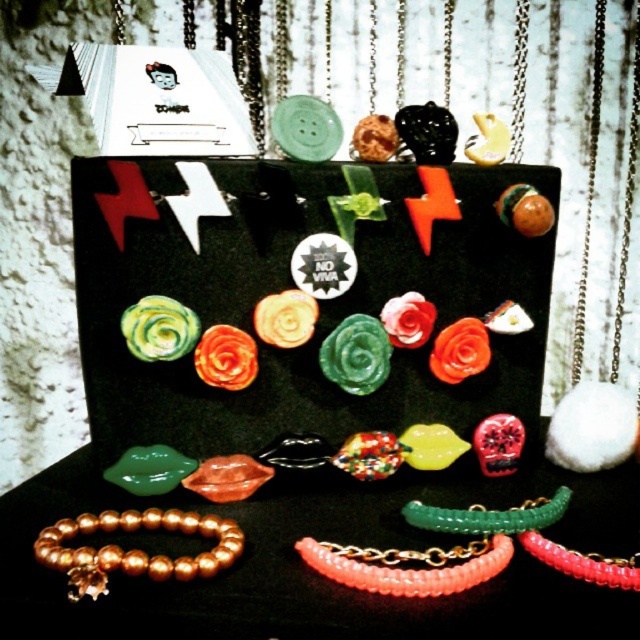
Which is more to the right, gold pearl bracelet at lower left or pink beaded bracelet at center?

pink beaded bracelet at center

From the picture: Is gold pearl bracelet at lower left above pink beaded bracelet at center?

Yes.

Which is behind, point (140, 568) or point (465, 573)?

The point (140, 568) is more distant.

At what (x,y) coordinates should I click in order to perform the action: click on gold pearl bracelet at lower left. Please return your answer as a coordinate pair (x, y). Looking at the image, I should click on [134, 548].

Is the position of pink beaded bracelet at center more distant than that of translucent coral beads at lower right?

No.

Does point (512, 545) come closer to viewer compared to point (520, 540)?

Yes, point (512, 545) is closer to viewer.

You are a GUI agent. You are given a task and a screenshot of the screen. Output one action in this format:
    pyautogui.click(x=<x>, y=<y>)
    Task: Click on the pink beaded bracelet at center
    
    Given the screenshot: What is the action you would take?
    pyautogui.click(x=406, y=570)

Can you confirm if green glass bracelet at center is thinner than translucent coral beads at lower right?

No, green glass bracelet at center is not thinner than translucent coral beads at lower right.

Who is taller, green glass bracelet at center or translucent coral beads at lower right?

Standing taller between the two is green glass bracelet at center.

Find the location of a particular element. The width and height of the screenshot is (640, 640). green glass bracelet at center is located at coordinates (488, 516).